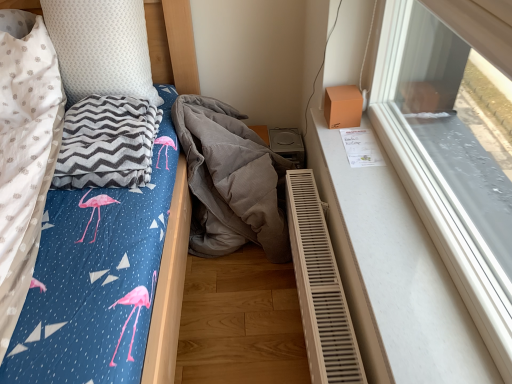
Question: Considering the relative positions of gray zigzag blanket at left and white dotted pillow at upper left in the image provided, is gray zigzag blanket at left to the right of white dotted pillow at upper left from the viewer's perspective?

Choices:
 (A) no
 (B) yes

Answer: (B)

Question: From a real-world perspective, does gray zigzag blanket at left stand above white dotted pillow at upper left?

Choices:
 (A) no
 (B) yes

Answer: (A)

Question: Can you confirm if gray zigzag blanket at left is thinner than white dotted pillow at upper left?

Choices:
 (A) yes
 (B) no

Answer: (B)

Question: Is gray zigzag blanket at left shorter than white dotted pillow at upper left?

Choices:
 (A) no
 (B) yes

Answer: (B)

Question: Is gray zigzag blanket at left further to camera compared to white dotted pillow at upper left?

Choices:
 (A) no
 (B) yes

Answer: (A)

Question: From their relative heights in the image, would you say gray zigzag blanket at left is taller or shorter than beige plastic radiator at lower right?

Choices:
 (A) short
 (B) tall

Answer: (A)

Question: From the image's perspective, relative to beige plastic radiator at lower right, is gray zigzag blanket at left above or below?

Choices:
 (A) below
 (B) above

Answer: (B)

Question: From a real-world perspective, is gray zigzag blanket at left positioned above or below beige plastic radiator at lower right?

Choices:
 (A) above
 (B) below

Answer: (A)

Question: Based on their sizes in the image, would you say gray zigzag blanket at left is bigger or smaller than beige plastic radiator at lower right?

Choices:
 (A) small
 (B) big

Answer: (A)

Question: Considering the positions of gray corduroy blanket at center and gray zigzag blanket at left in the image, is gray corduroy blanket at center taller or shorter than gray zigzag blanket at left?

Choices:
 (A) tall
 (B) short

Answer: (A)

Question: Is gray corduroy blanket at center wider or thinner than gray zigzag blanket at left?

Choices:
 (A) thin
 (B) wide

Answer: (B)

Question: Considering their positions, is gray corduroy blanket at center located in front of or behind gray zigzag blanket at left?

Choices:
 (A) front
 (B) behind

Answer: (B)

Question: Is point (238, 178) closer or farther from the camera than point (101, 129)?

Choices:
 (A) closer
 (B) farther

Answer: (B)

Question: Visually, is gray zigzag blanket at left positioned to the left or to the right of transparent glass window at upper right?

Choices:
 (A) left
 (B) right

Answer: (A)

Question: From a real-world perspective, is gray zigzag blanket at left positioned above or below transparent glass window at upper right?

Choices:
 (A) below
 (B) above

Answer: (A)